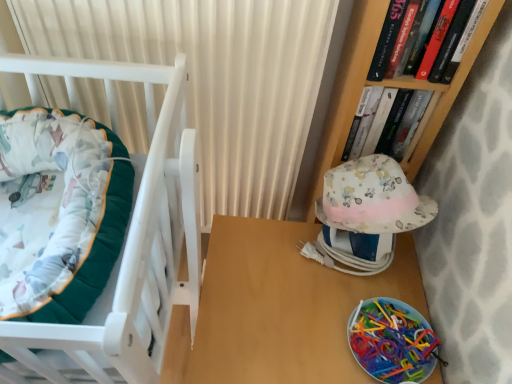
Image resolution: width=512 pixels, height=384 pixels. I want to click on vacant space that is in between fluffy cotton hat at right and translucent plastic plate at lower right, so click(x=360, y=297).